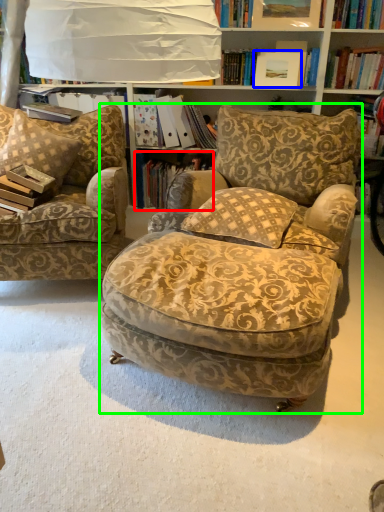
Question: Which object is the farthest from book (highlighted by a red box)? Choose among these: picture frame (highlighted by a blue box) or chair (highlighted by a green box).

Choices:
 (A) picture frame
 (B) chair

Answer: (B)